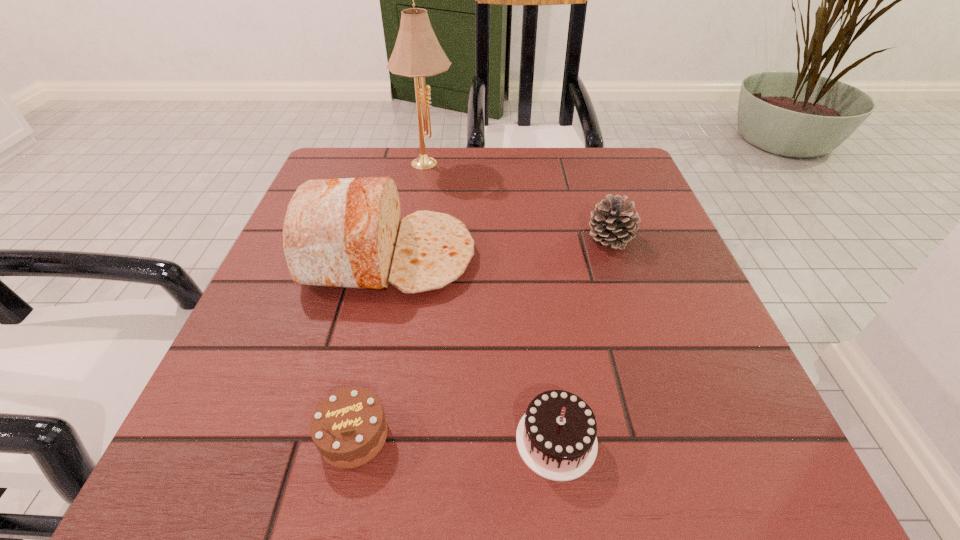
Identify the location of the tallest object. (417, 53).

Image resolution: width=960 pixels, height=540 pixels. Identify the location of lampshade. (417, 53).

The image size is (960, 540). In order to click on the second tallest object in this screenshot , I will do `click(344, 233)`.

Identify the location of the rightmost object. (613, 223).

Identify the location of the third shortest object. (613, 223).

This screenshot has height=540, width=960. I want to click on the fourth tallest object, so click(x=556, y=438).

Identify the location of the fourth object from left to right. (556, 438).

You are a GUI agent. You are given a task and a screenshot of the screen. Output one action in this format:
    pyautogui.click(x=<x>, y=<y>)
    Task: Click on the shorter chocolate cake
    
    Given the screenshot: What is the action you would take?
    pyautogui.click(x=349, y=428)

This screenshot has height=540, width=960. I want to click on the left chocolate cake, so click(x=349, y=428).

Find the location of `vacant space located on the front of the lampshade`. vacant space located on the front of the lampshade is located at coordinates (411, 256).